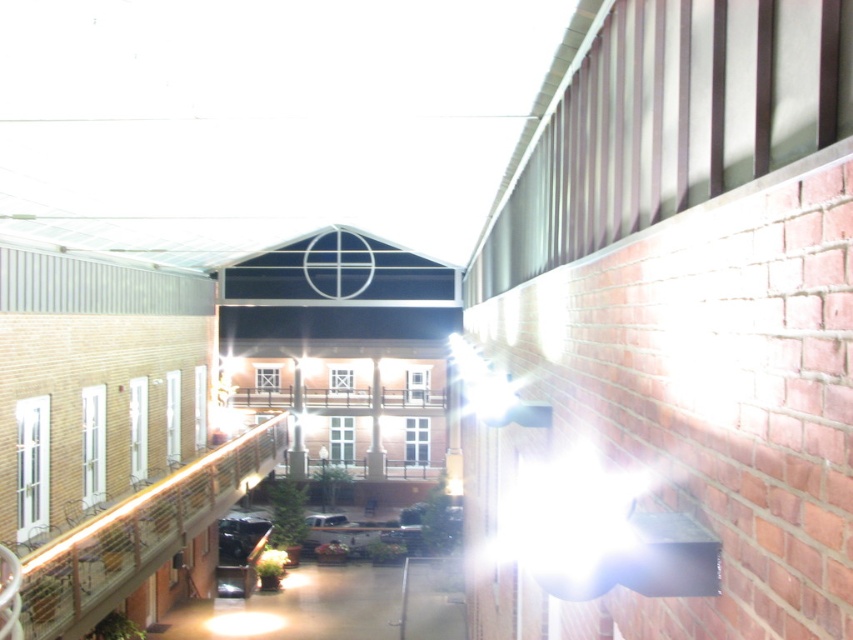
Is point (250, 531) less distant than point (345, 518)?

That is True.

Measure the distance between shiny black car at lower left and camera.

A distance of 28.61 meters exists between shiny black car at lower left and camera.

Describe the element at coordinates (239, 538) in the screenshot. The width and height of the screenshot is (853, 640). I see `shiny black car at lower left` at that location.

Where is `shiny black car at lower left`? shiny black car at lower left is located at coordinates (239, 538).